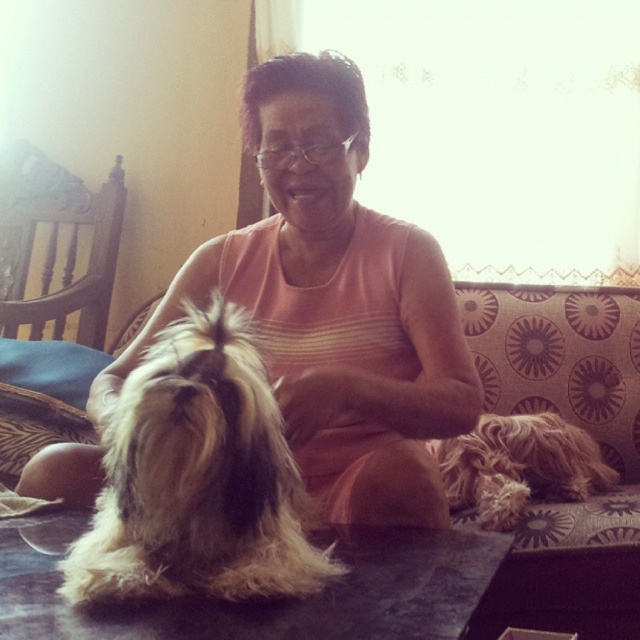
Which is below, fuzzy brown dog at center or fuzzy brown dog at lower right?

fuzzy brown dog at lower right is below.

Which of these two, fuzzy brown dog at center or fuzzy brown dog at lower right, stands shorter?

fuzzy brown dog at lower right

Is point (248, 509) farther from viewer compared to point (515, 513)?

No.

Identify the location of fuzzy brown dog at center. This screenshot has width=640, height=640. (196, 477).

Does point (88, 461) come farther from viewer compared to point (45, 369)?

That is False.

Is point (332, 408) in front of point (504, 612)?

That is True.

The image size is (640, 640). What do you see at coordinates (333, 305) in the screenshot?
I see `matte peach shirt at center` at bounding box center [333, 305].

The width and height of the screenshot is (640, 640). I want to click on matte peach shirt at center, so click(333, 305).

Is fuzzy brown dog at center positioned before patterned fabric couch at center?

Yes, fuzzy brown dog at center is in front of patterned fabric couch at center.

Which is behind, point (196, 426) or point (506, 580)?

The point (506, 580) is behind.

Is point (125, 515) closer to camera compared to point (531, 598)?

Yes, it is.

Locate an element on the screen. Image resolution: width=640 pixels, height=640 pixels. fuzzy brown dog at center is located at coordinates (196, 477).